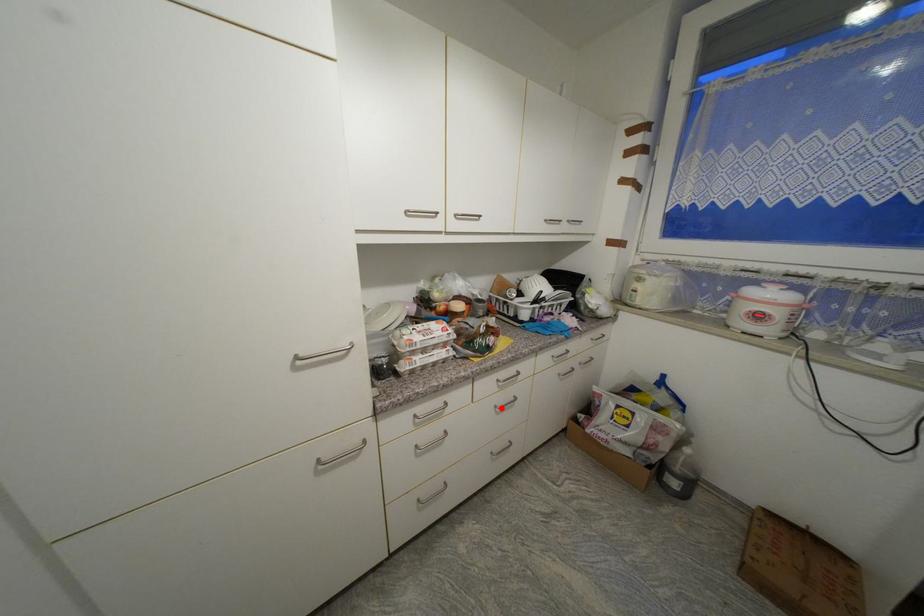
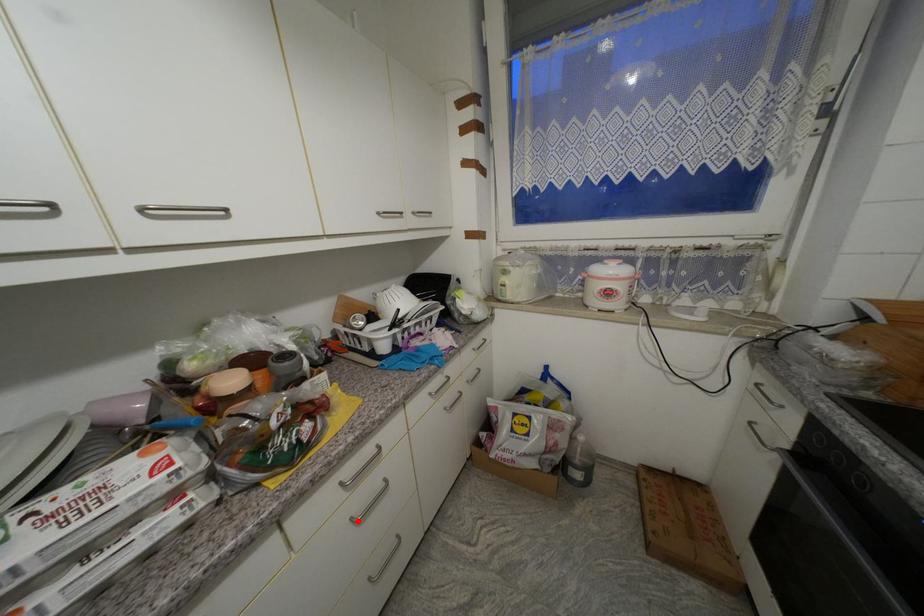
I am providing you with two images of the same scene from different viewpoints. A red point is marked on the first image and another point is marked on the second image. Do the highlighted points in image1 and image2 indicate the same real-world spot?

Yes